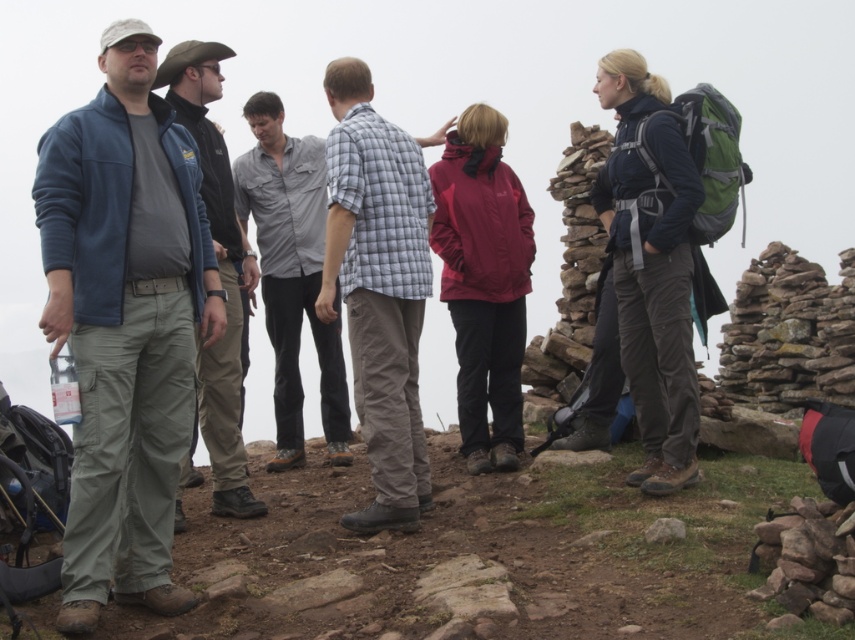
Question: Estimate the real-world distances between objects in this image. Which object is closer to the dark blue fabric jacket at right?

Choices:
 (A) matte blue jacket at left
 (B) plaid cotton shirt at center
 (C) gray cotton shirt at center
 (D) brushed metal jacket at left

Answer: (B)

Question: Which point is farther to the camera?

Choices:
 (A) gray cotton shirt at center
 (B) plaid cotton shirt at center

Answer: (A)

Question: Is matte blue jacket at left closer to the viewer compared to plaid cotton shirt at center?

Choices:
 (A) yes
 (B) no

Answer: (A)

Question: Considering the real-world distances, which object is farthest from the plaid cotton shirt at center?

Choices:
 (A) dark blue fabric jacket at right
 (B) matte blue jacket at left
 (C) brushed metal jacket at left

Answer: (A)

Question: Can you confirm if dark blue fabric jacket at right is wider than gray cotton shirt at center?

Choices:
 (A) no
 (B) yes

Answer: (A)

Question: Is plaid cotton shirt at center closer to camera compared to dark blue fabric jacket at right?

Choices:
 (A) yes
 (B) no

Answer: (A)